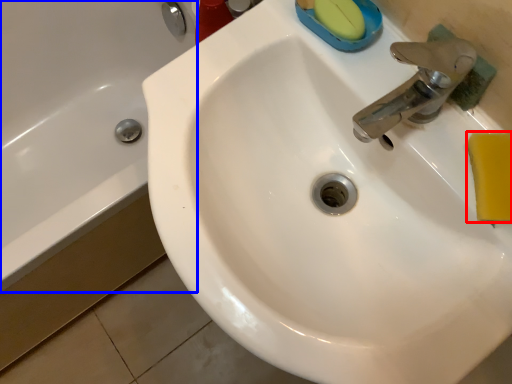
Question: Which object is further to the camera taking this photo, soap (highlighted by a red box) or bath (highlighted by a blue box)?

Choices:
 (A) soap
 (B) bath

Answer: (B)